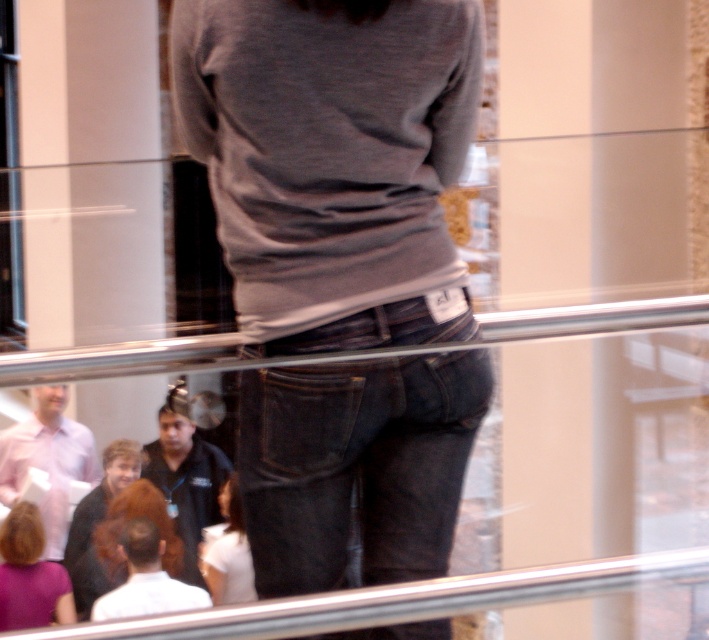
Is dark blue denim jeans at center taller than white matte shirt at center?

In fact, dark blue denim jeans at center may be shorter than white matte shirt at center.

I want to click on dark blue denim jeans at center, so click(x=357, y=467).

Between point (407, 448) and point (216, 580), which one is positioned behind?

The point (216, 580) is more distant.

You are a GUI agent. You are given a task and a screenshot of the screen. Output one action in this format:
    pyautogui.click(x=<x>, y=<y>)
    Task: Click on the dark blue denim jeans at center
    
    Given the screenshot: What is the action you would take?
    point(357,467)

Can you confirm if dark blue denim jeans at center is bigger than purple matte hair at lower left?

No, dark blue denim jeans at center is not bigger than purple matte hair at lower left.

Who is positioned more to the right, dark blue denim jeans at center or purple matte hair at lower left?

dark blue denim jeans at center is more to the right.

At what (x,y) coordinates should I click in order to perform the action: click on dark blue denim jeans at center. Please return your answer as a coordinate pair (x, y). Looking at the image, I should click on (357, 467).

You are a GUI agent. You are given a task and a screenshot of the screen. Output one action in this format:
    pyautogui.click(x=<x>, y=<y>)
    Task: Click on the purple matte hair at lower left
    
    Given the screenshot: What is the action you would take?
    pyautogui.click(x=30, y=573)

Can you confirm if purple matte hair at lower left is positioned above white matte shirt at center?

Incorrect, purple matte hair at lower left is not positioned above white matte shirt at center.

Does point (67, 596) come farther from viewer compared to point (238, 515)?

No, it is in front of (238, 515).

You are a GUI agent. You are given a task and a screenshot of the screen. Output one action in this format:
    pyautogui.click(x=<x>, y=<y>)
    Task: Click on the purple matte hair at lower left
    The height and width of the screenshot is (640, 709).
    Given the screenshot: What is the action you would take?
    pyautogui.click(x=30, y=573)